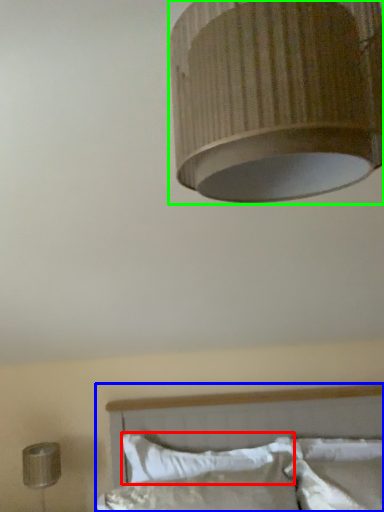
Question: Based on their relative distances, which object is farther from pillow (highlighted by a red box)? Choose from bed (highlighted by a blue box) and lamp (highlighted by a green box).

Choices:
 (A) bed
 (B) lamp

Answer: (B)